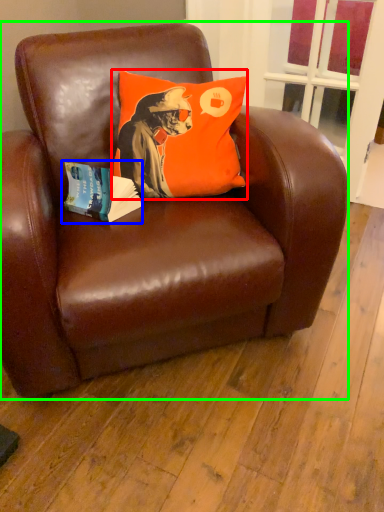
Question: Based on their relative distances, which object is farther from pillow (highlighted by a red box)? Choose from paperback book (highlighted by a blue box) and chair (highlighted by a green box).

Choices:
 (A) paperback book
 (B) chair

Answer: (B)